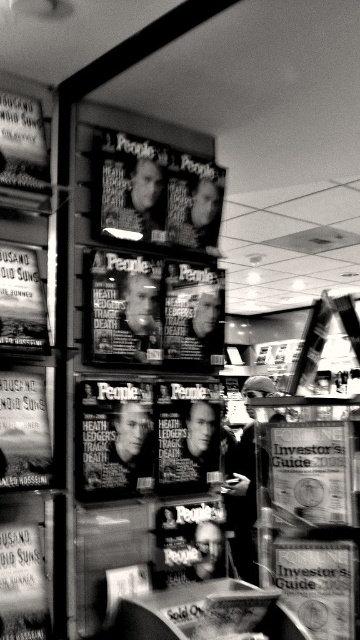
Question: Among these objects, which one is farthest from the camera?

Choices:
 (A) paperback book at center
 (B) matte paper poster at lower left
 (C) smooth skin face at center
 (D) metallic silver poster at lower left

Answer: (A)

Question: Which is nearer to the matte black sign at upper left?

Choices:
 (A) paperback book at center
 (B) matte paper poster at upper left
 (C) metallic silver poster at lower left

Answer: (B)

Question: Is matte paper poster at upper left to the left of matte black sign at upper left from the viewer's perspective?

Choices:
 (A) yes
 (B) no

Answer: (A)

Question: Can you confirm if paperback book at lower right is smaller than metallic silver poster at lower left?

Choices:
 (A) yes
 (B) no

Answer: (B)

Question: Which is farther from the matte paper poster at lower left?

Choices:
 (A) smooth skin face at center
 (B) matte black sign at upper left
 (C) metallic silver poster at lower left
 (D) matte paper poster at upper left

Answer: (A)

Question: Is metallic silver poster at lower left further to camera compared to smooth skin face at center?

Choices:
 (A) yes
 (B) no

Answer: (B)